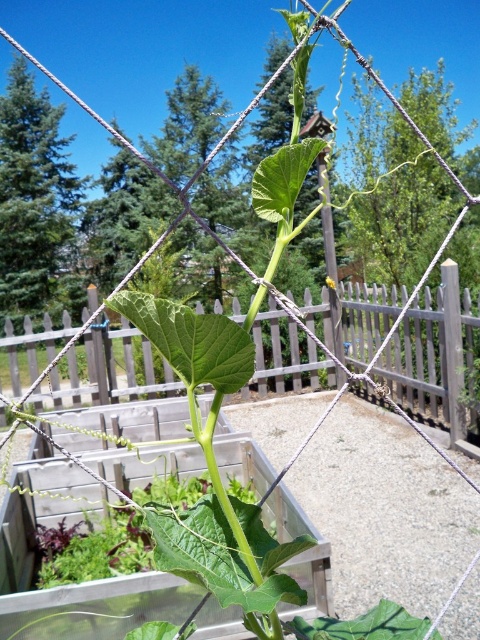
You are a gardener who wants to plant a new flower that requires 30 cm of space above it to grow properly. Looking at the wooden at center and the yellow matte flower at center, which one do you think has enough vertical space above it for the new flower?

The wooden at center has a greater height compared to yellow matte flower at center, so it provides more vertical space. Therefore, the wooden at center would have enough vertical space above it for the new flower that requires 30 cm.

You are a gardener who wants to place a new plant between the wooden at center and the yellow matte flower at center. Based on their positions, which object should you place the new plant closer to?

The wooden at center is positioned on the right side of the yellow matte flower at center, so to place the new plant between them, it should be closer to the yellow matte flower at center.

You are standing in the garden looking at the two points marked in the image. Which point is closer to you, point [86,349] or point [328,276]?

Point [86,349] is in front of point [328,276], so it is closer to you.